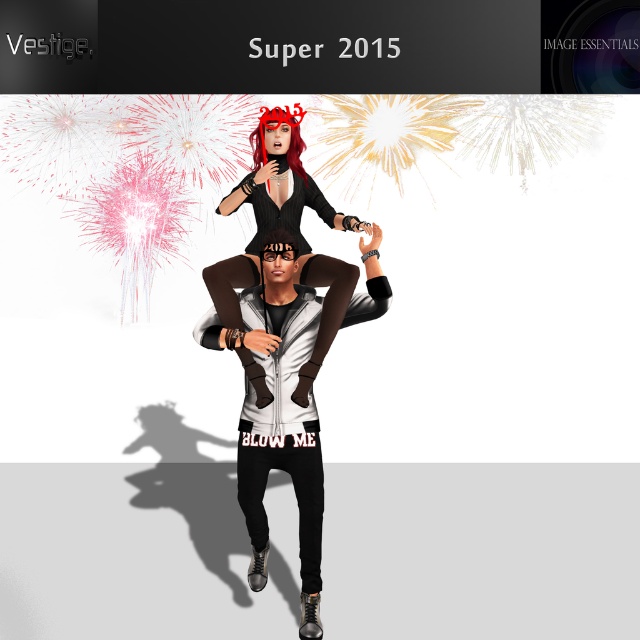
You are an event planner organizing a fireworks show. You need to ensure that the white matte jacket at center and the matte black dress at center are visible to the audience. Based on their positions, which one is more likely to be seen clearly by the audience?

The matte black dress at center is more likely to be seen clearly by the audience because it is positioned higher than the white matte jacket at center, which is located below it.

Based on the scene described, can you determine if the white matte jacket at center is wider than the matte black dress at center?

The white matte jacket at center might be wider than matte black dress at center according to the description.

What is the position of the point with coordinates [278,412] in relation to the white matte jacket at center?

The point with coordinates [278,412] is located on the white matte jacket at center.